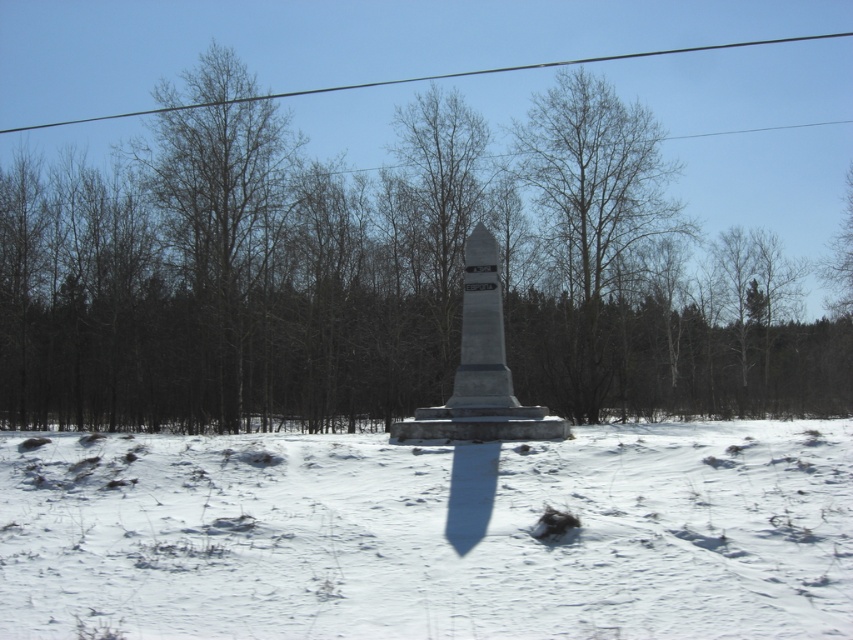
You are a photographer planning to take a picture of the winter scene. You want to ensure both the bare wood tree at center and the black wire at upper center are clearly visible in your shot. Based on their positions, which object might partially block the view of the other?

The bare wood tree at center is in front of the black wire at upper center, so it might partially block the view of the black wire at upper center.

You are standing in front of the monument and notice two points marked in the snow. The first point is at coordinates point (556, 349) and the second is at point (827, 36). Which point is closer to your current position?

Point (556, 349) is closer to the viewer than point (827, 36), so the first point is closer to your current position.

You are a photographer setting up equipment in the winter landscape scene. You need to place a tripod between the brown wood tree at center and the black wire at upper center. Which object should you position the tripod closer to so that it fits within the space between them?

The brown wood tree at center is narrower than the black wire at upper center, so you should position the tripod closer to the brown wood tree at center to ensure it fits within the space between them.